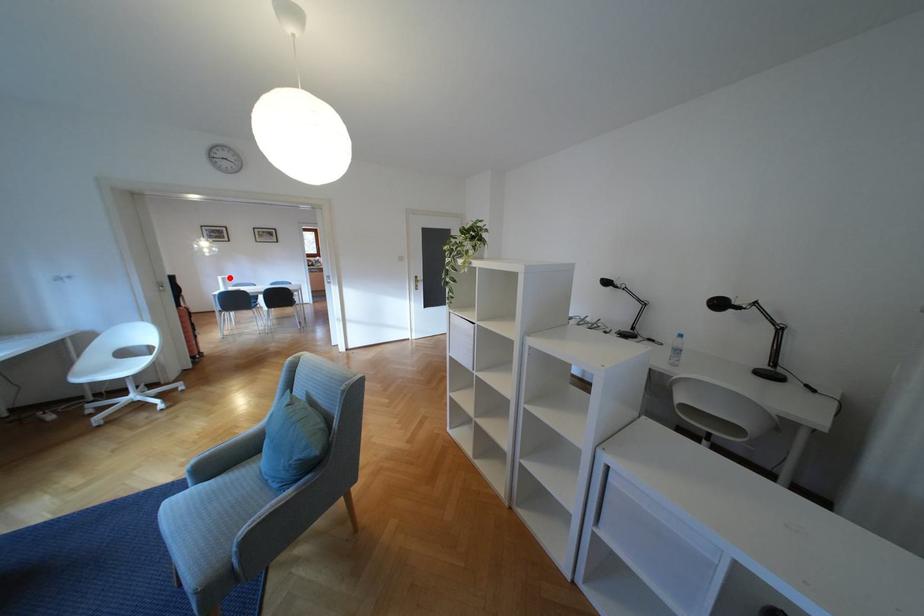
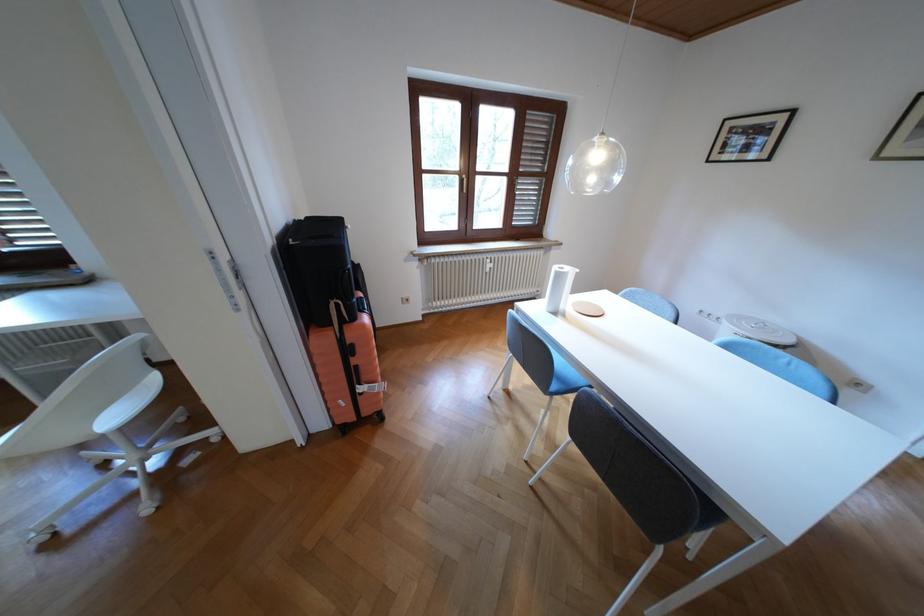
Question: I am providing you with two images of the same scene from different viewpoints. In image1, a red point is highlighted. Considering the same 3D point in image2, which of the following is correct?

Choices:
 (A) It is closer
 (B) It is farther

Answer: (A)